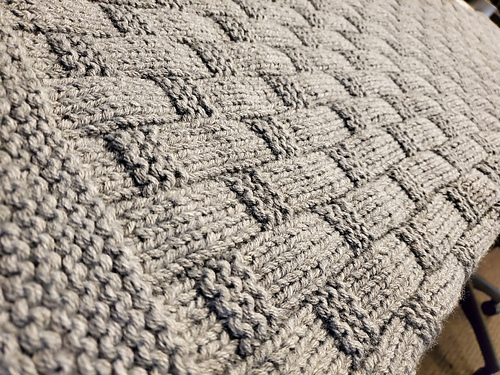
The height and width of the screenshot is (375, 500). I want to click on rug, so click(x=282, y=176).